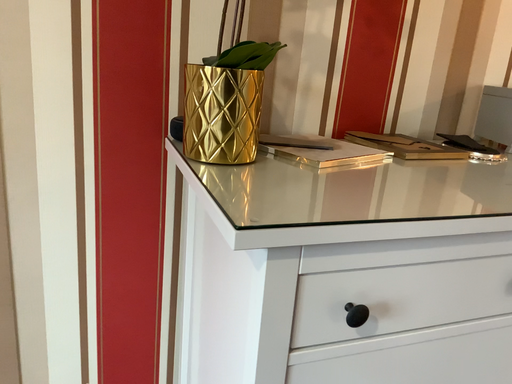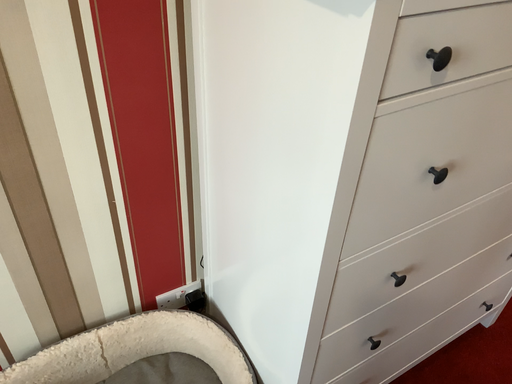
Question: Which way did the camera rotate in the video?

Choices:
 (A) rotated upward
 (B) rotated downward

Answer: (B)